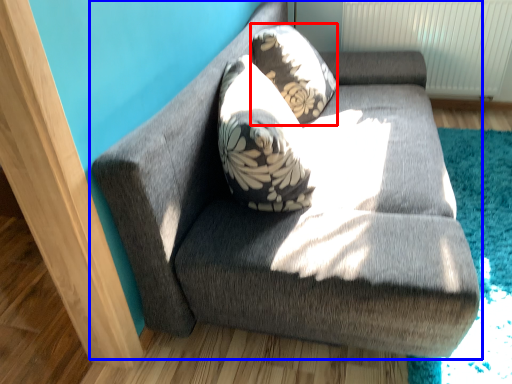
Question: Which point is closer to the camera, throw pillow (highlighted by a red box) or studio couch (highlighted by a blue box)?

Choices:
 (A) throw pillow
 (B) studio couch

Answer: (B)